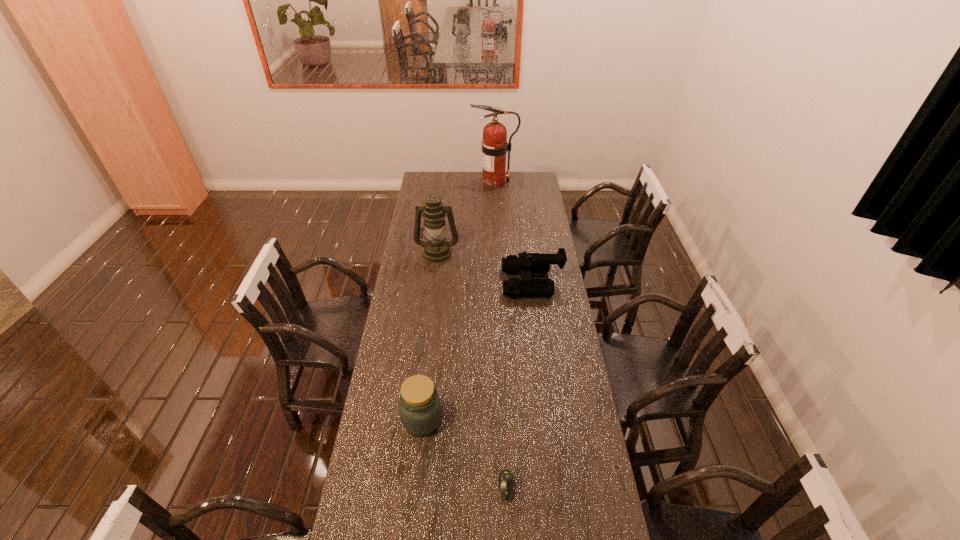
This screenshot has height=540, width=960. In order to click on vacant space that satisfies the following two spatial constraints: 1. on the front lenses of the third nearest object; 2. on the wheel side of the computer mouse in this screenshot , I will do tap(558, 486).